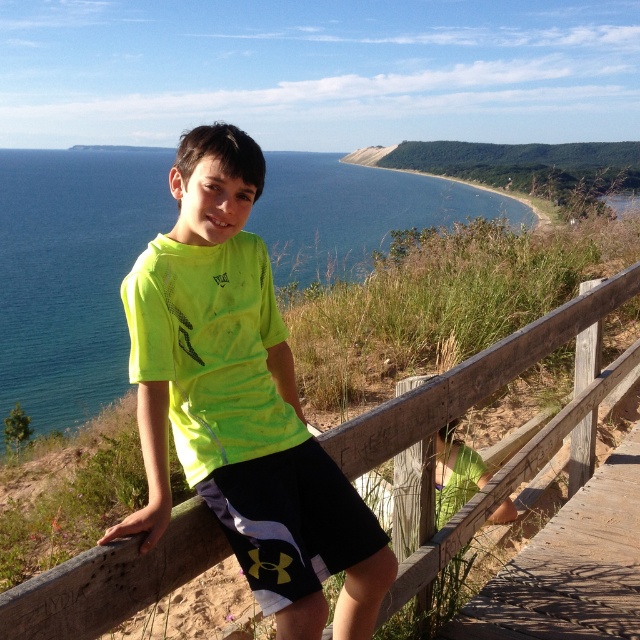
Who is positioned more to the right, neon yellow t-shirt at center or black synthetic shorts at center?

black synthetic shorts at center is more to the right.

Is neon yellow t-shirt at center closer to camera compared to black synthetic shorts at center?

Yes, neon yellow t-shirt at center is closer to the viewer.

Locate an element on the screen. This screenshot has height=640, width=640. neon yellow t-shirt at center is located at coordinates (241, 403).

Does blue water at upper left appear on the left side of black synthetic shorts at center?

Indeed, blue water at upper left is positioned on the left side of black synthetic shorts at center.

What are the coordinates of `blue water at upper left` in the screenshot? It's located at (70, 273).

Is neon yellow t-shirt at center taller than blue water at upper left?

No.

Between point (298, 472) and point (90, 292), which one is positioned behind?

Point (90, 292)

Where is `neon yellow t-shirt at center`? neon yellow t-shirt at center is located at coordinates (241, 403).